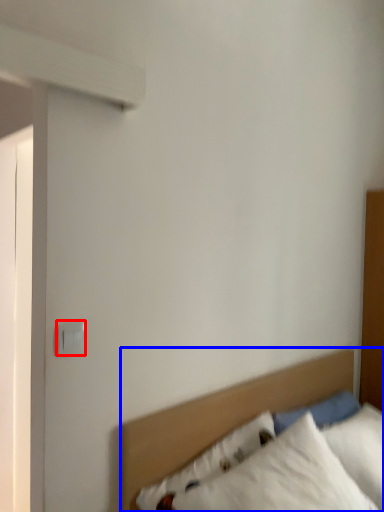
Question: Which object appears closest to the camera in this image, electric outlet (highlighted by a red box) or bed (highlighted by a blue box)?

Choices:
 (A) electric outlet
 (B) bed

Answer: (B)